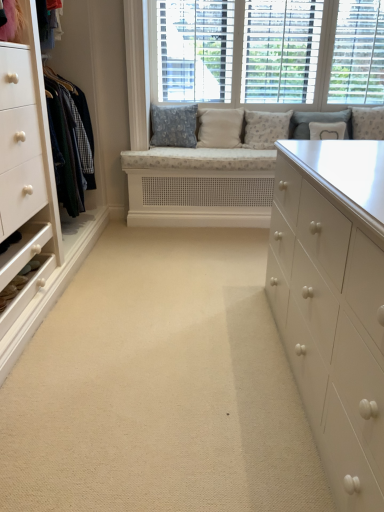
Question: Could you tell me if white textured cushions at upper center is turned towards patterned fabric pillow at center, the 4th pillow in the right-to-left sequence?

Choices:
 (A) no
 (B) yes

Answer: (A)

Question: Can you confirm if white textured cushions at upper center is thinner than patterned fabric pillow at center, which is the third pillow in left-to-right order?

Choices:
 (A) yes
 (B) no

Answer: (A)

Question: Is the depth of white textured cushions at upper center greater than that of patterned fabric pillow at center, the 4th pillow in the right-to-left sequence?

Choices:
 (A) yes
 (B) no

Answer: (B)

Question: From the image's perspective, is white textured cushions at upper center under patterned fabric pillow at center, the 4th pillow in the right-to-left sequence?

Choices:
 (A) yes
 (B) no

Answer: (B)

Question: Can you confirm if white textured cushions at upper center is bigger than patterned fabric pillow at center, the 4th pillow in the right-to-left sequence?

Choices:
 (A) no
 (B) yes

Answer: (B)

Question: From the image's perspective, is white fabric pillow at upper center, the 5th pillow in the left-to-right sequence, positioned above or below beige fabric pillow at center, which ranks as the second pillow in left-to-right order?

Choices:
 (A) above
 (B) below

Answer: (B)

Question: Is point (344, 129) closer or farther from the camera than point (230, 117)?

Choices:
 (A) closer
 (B) farther

Answer: (A)

Question: Based on their positions, is white fabric pillow at upper center, which ranks as the second pillow in right-to-left order, located to the left or right of beige fabric pillow at center, which ranks as the second pillow in left-to-right order?

Choices:
 (A) left
 (B) right

Answer: (B)

Question: From a real-world perspective, relative to beige fabric pillow at center, which is counted as the fifth pillow, starting from the right, is white fabric pillow at upper center, the 5th pillow in the left-to-right sequence, vertically above or below?

Choices:
 (A) above
 (B) below

Answer: (B)

Question: In terms of width, does white textured pillow at upper center, the fourth pillow positioned from the left, look wider or thinner when compared to white fabric pillow at upper center, the 5th pillow in the left-to-right sequence?

Choices:
 (A) wide
 (B) thin

Answer: (A)

Question: Considering the relative positions of white textured pillow at upper center, the fourth pillow positioned from the left, and white fabric pillow at upper center, which ranks as the second pillow in right-to-left order, in the image provided, is white textured pillow at upper center, the fourth pillow positioned from the left, to the left or to the right of white fabric pillow at upper center, which ranks as the second pillow in right-to-left order,?

Choices:
 (A) left
 (B) right

Answer: (A)

Question: Does point click(x=297, y=122) appear closer or farther from the camera than point click(x=329, y=124)?

Choices:
 (A) closer
 (B) farther

Answer: (B)

Question: In the image, is white textured pillow at upper center, placed as the third pillow when sorted from right to left, positioned in front of or behind white fabric pillow at upper center, which ranks as the second pillow in right-to-left order?

Choices:
 (A) front
 (B) behind

Answer: (B)

Question: Would you say white fabric pillow at upper center, the 5th pillow in the left-to-right sequence, is inside or outside textured blue pillow at center, which ranks as the 6th pillow in right-to-left order?

Choices:
 (A) outside
 (B) inside

Answer: (A)

Question: From the image's perspective, is white fabric pillow at upper center, which ranks as the second pillow in right-to-left order, above or below textured blue pillow at center, the first pillow positioned from the left?

Choices:
 (A) above
 (B) below

Answer: (B)